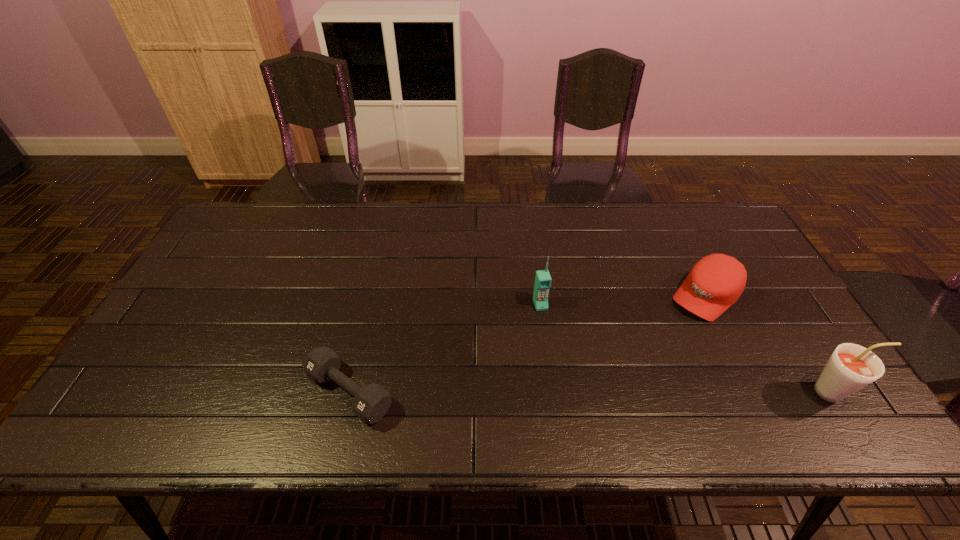
Where is `the shortest object`? Image resolution: width=960 pixels, height=540 pixels. the shortest object is located at coordinates (372, 402).

Locate an element on the screen. The width and height of the screenshot is (960, 540). dumbbell is located at coordinates (372, 402).

Identify the location of root beer. (851, 367).

Where is `the second object from right to left`? This screenshot has width=960, height=540. the second object from right to left is located at coordinates (715, 282).

At what (x,y) coordinates should I click in order to perform the action: click on the second shortest object. Please return your answer as a coordinate pair (x, y). This screenshot has height=540, width=960. Looking at the image, I should click on (715, 282).

Find the location of a particular element. cellular telephone is located at coordinates (543, 279).

You are a GUI agent. You are given a task and a screenshot of the screen. Output one action in this format:
    pyautogui.click(x=<x>, y=<y>)
    Task: Click on the vacant space situated 0.050m on the back of the dumbbell
    The image size is (960, 540).
    Given the screenshot: What is the action you would take?
    pyautogui.click(x=361, y=343)

At what (x,y) coordinates should I click in order to perform the action: click on blank area located on the front-facing side of the second shortest object. Please return your answer as a coordinate pair (x, y). The width and height of the screenshot is (960, 540). Looking at the image, I should click on (623, 376).

This screenshot has width=960, height=540. Identify the location of vacant region located on the front-facing side of the second shortest object. (653, 347).

Find the location of `vacant area situated 0.060m on the front-facing side of the second shortest object`. vacant area situated 0.060m on the front-facing side of the second shortest object is located at coordinates tap(676, 325).